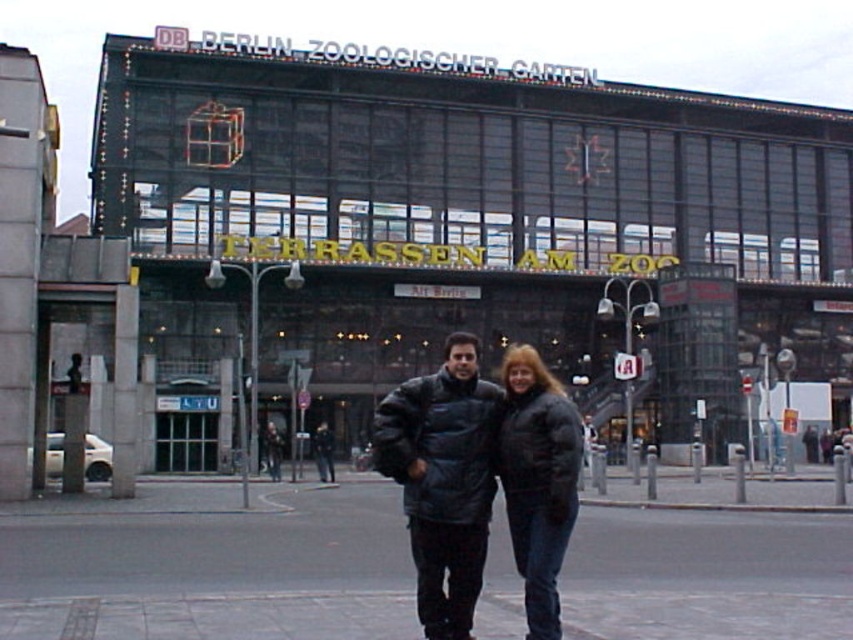
Consider the image. Is smooth concrete pavement at center wider than black puffy jackets at center?

Correct, the width of smooth concrete pavement at center exceeds that of black puffy jackets at center.

From the picture: Between smooth concrete pavement at center and black puffy jackets at center, which one has less height?

smooth concrete pavement at center

This screenshot has height=640, width=853. What are the coordinates of `smooth concrete pavement at center` in the screenshot? It's located at (207, 564).

Is black puffy jackets at center bigger than black puffy coat at center?

Yes, black puffy jackets at center is bigger than black puffy coat at center.

Does black puffy jackets at center have a lesser height compared to black puffy coat at center?

Incorrect, black puffy jackets at center's height does not fall short of black puffy coat at center's.

Does point (457, 419) lie behind point (567, 538)?

Yes, it is.

Find the location of a particular element. The width and height of the screenshot is (853, 640). black puffy jackets at center is located at coordinates (445, 477).

Which is below, smooth concrete pavement at center or black puffy coat at center?

smooth concrete pavement at center

Looking at this image, who is more distant from viewer, (93, 532) or (535, 484)?

The point (93, 532) is more distant.

This screenshot has height=640, width=853. What are the coordinates of `smooth concrete pavement at center` in the screenshot? It's located at (207, 564).

Image resolution: width=853 pixels, height=640 pixels. Find the location of `smooth concrete pavement at center`. smooth concrete pavement at center is located at coordinates (207, 564).